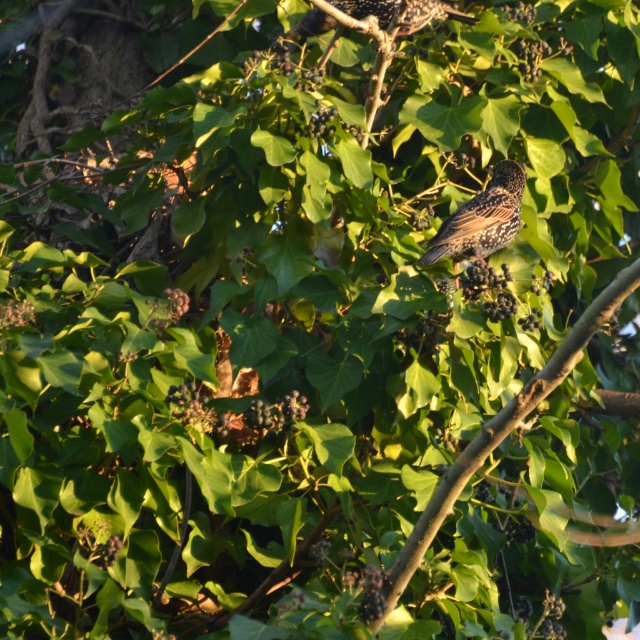
You are a birdwatcher observing the scene. You notice the brown speckled bird at upper center and the brown wood tree branch at center. Which object takes up more space in the image?

The brown wood tree branch at center is larger in size than the brown speckled bird at upper center, so it takes up more space in the image.